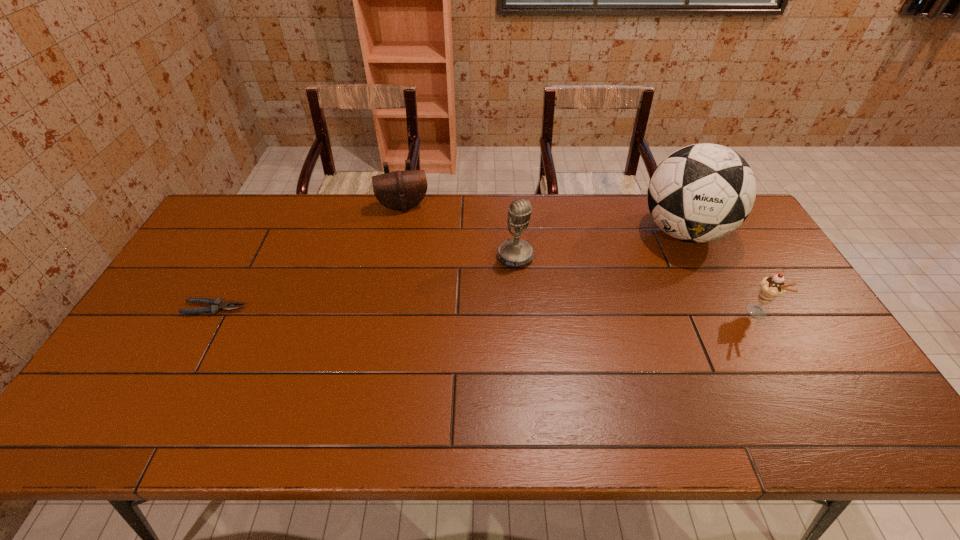
Where is `object located in the left edge section of the desktop`? Image resolution: width=960 pixels, height=540 pixels. object located in the left edge section of the desktop is located at coordinates (217, 304).

Locate an element on the screen. icecream positioned at the right edge is located at coordinates (772, 287).

Where is `soccer ball that is positioned at the right edge`? The width and height of the screenshot is (960, 540). soccer ball that is positioned at the right edge is located at coordinates (702, 192).

Find the location of a particular element. The image size is (960, 540). object present at the far right corner is located at coordinates (702, 192).

In order to click on free space at the far edge of the desktop in this screenshot , I will do `click(400, 234)`.

Find the location of a particular element. vacant position at the near edge of the desktop is located at coordinates (443, 376).

This screenshot has height=540, width=960. Identify the location of vacant space at the left edge of the desktop. (180, 283).

The height and width of the screenshot is (540, 960). I want to click on vacant space at the right edge, so click(x=748, y=278).

In the image, there is a desktop. Where is `free space at the far left corner`? free space at the far left corner is located at coordinates (244, 225).

Where is `vacant space in between the second object from left to right and the pliers`? vacant space in between the second object from left to right and the pliers is located at coordinates (309, 257).